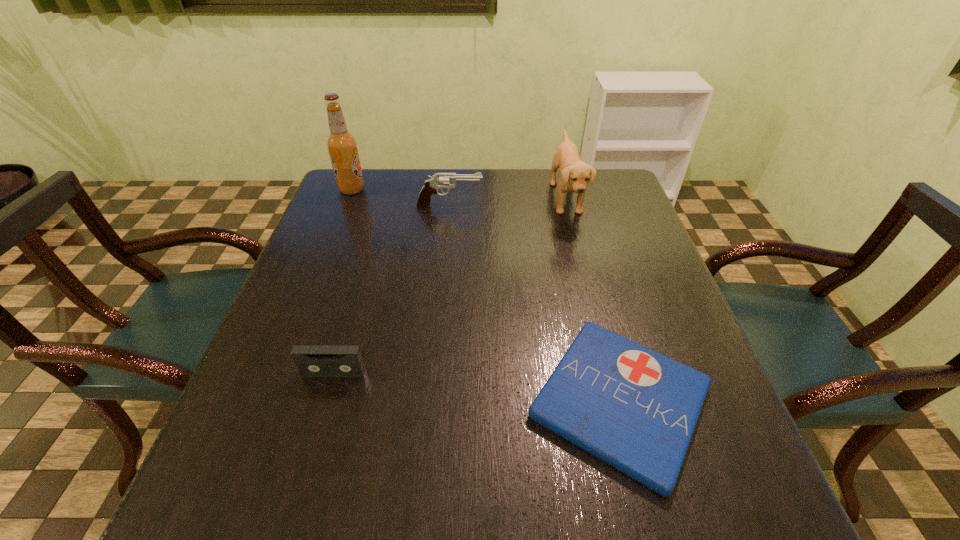
I want to click on the leftmost object, so click(x=342, y=146).

Where is `the tallest object`? The image size is (960, 540). the tallest object is located at coordinates pyautogui.click(x=342, y=146).

At what (x,y) coordinates should I click in order to perform the action: click on puppy. Please return your answer as a coordinate pair (x, y). Looking at the image, I should click on (574, 174).

The height and width of the screenshot is (540, 960). What are the coordinates of `gun` in the screenshot? It's located at (439, 180).

I want to click on the third object from right to left, so click(x=439, y=180).

You are a GUI agent. You are given a task and a screenshot of the screen. Output one action in this format:
    pyautogui.click(x=<x>, y=<y>)
    Task: Click on the videotape
    Image resolution: width=960 pixels, height=540 pixels.
    Given the screenshot: What is the action you would take?
    pyautogui.click(x=311, y=360)

Where is `the second shortest object`? This screenshot has width=960, height=540. the second shortest object is located at coordinates (311, 360).

This screenshot has height=540, width=960. I want to click on the shortest object, so click(x=636, y=409).

The width and height of the screenshot is (960, 540). In order to click on vacant area situated 0.120m on the front label of the beer bottle in this screenshot , I will do `click(406, 190)`.

Identify the location of vacant space located on the left side of the fourth shortest object. This screenshot has width=960, height=540. (471, 198).